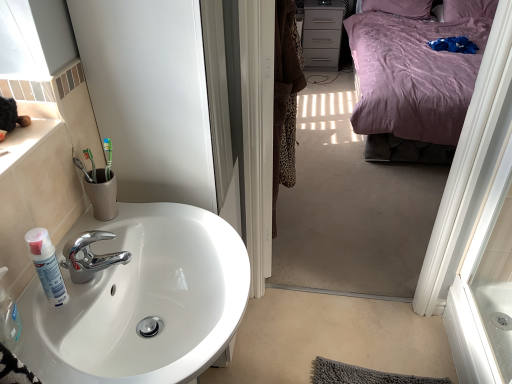
Find the location of a particular element. The image size is (512, 384). purple satin pillow at upper right is located at coordinates (468, 9).

Describe the element at coordinates (468, 9) in the screenshot. The image size is (512, 384). I see `purple satin pillow at upper right` at that location.

Find the location of a particular element. This screenshot has height=384, width=512. white glossy sink at lower left is located at coordinates (142, 301).

The width and height of the screenshot is (512, 384). Describe the element at coordinates (91, 164) in the screenshot. I see `green toothbrush at sink` at that location.

In order to click on green toothbrush at sink in this screenshot , I will do `click(91, 164)`.

This screenshot has width=512, height=384. Find the location of `purple satin pillow at upper right`. purple satin pillow at upper right is located at coordinates (468, 9).

Is purple satin bed at upper right thinner than matte gray cabinet at upper right?

No, purple satin bed at upper right is not thinner than matte gray cabinet at upper right.

Looking at this image, from a real-world perspective, is purple satin bed at upper right beneath matte gray cabinet at upper right?

No, from a real-world perspective, purple satin bed at upper right is not under matte gray cabinet at upper right.

Are purple satin bed at upper right and matte gray cabinet at upper right making contact?

No, purple satin bed at upper right is not in contact with matte gray cabinet at upper right.

Considering the relative sizes of purple satin bed at upper right and matte gray cabinet at upper right in the image provided, is purple satin bed at upper right smaller than matte gray cabinet at upper right?

Actually, purple satin bed at upper right might be larger than matte gray cabinet at upper right.

How distant is green toothbrush at sink from matte gray cabinet at upper right?

green toothbrush at sink is 3.55 meters away from matte gray cabinet at upper right.

From a real-world perspective, which object stands above the other?

green toothbrush at sink is physically above.

In the image, is green toothbrush at sink positioned in front of or behind matte gray cabinet at upper right?

green toothbrush at sink is positioned closer to the viewer than matte gray cabinet at upper right.

Between green toothbrush at sink and matte gray cabinet at upper right, which one has more height?

With more height is matte gray cabinet at upper right.

Find the location of a particular element. Image resolution: width=512 pixels, height=384 pixels. bed above the green toothbrush at sink (from the image's perspective) is located at coordinates pos(412,85).

Which is behind, point (96, 177) or point (389, 18)?

The point (389, 18) is farther.

From the image's perspective, is green toothbrush at sink on purple satin bed at upper right?

No.

Does green toothbrush at sink have a greater height compared to purple satin bed at upper right?

No.

Is point (44, 230) closer or farther from the camera than point (170, 322)?

Point (44, 230) appears to be closer to the viewer than point (170, 322).

Is white matte spray can at sink left with white glossy sink at lower left?

No, white matte spray can at sink left is not in contact with white glossy sink at lower left.

From a real-world perspective, which object rests below the other?

From a 3D spatial view, white glossy sink at lower left is below.

Is white matte spray can at sink left positioned with its back to white glossy sink at lower left?

No.

Is purple satin pillow at upper right not within green toothbrush at sink?

That's correct, purple satin pillow at upper right is outside of green toothbrush at sink.

Does purple satin pillow at upper right have a greater height compared to green toothbrush at sink?

Indeed, purple satin pillow at upper right has a greater height compared to green toothbrush at sink.

Is there a large distance between purple satin pillow at upper right and green toothbrush at sink?

Yes.

From a real-world perspective, is purple satin pillow at upper right positioned over green toothbrush at sink based on gravity?

No.

Does green toothbrush at sink have a smaller size compared to white glossy sink at lower left?

Indeed, green toothbrush at sink has a smaller size compared to white glossy sink at lower left.

Is green toothbrush at sink far away from white glossy sink at lower left?

Actually, green toothbrush at sink and white glossy sink at lower left are a little close together.

You are a GUI agent. You are given a task and a screenshot of the screen. Output one action in this format:
    pyautogui.click(x=<x>, y=<y>)
    Task: Click on the sink that is under the green toothbrush at sink (from a real-world perspective)
    
    Given the screenshot: What is the action you would take?
    pyautogui.click(x=142, y=301)

Is point (95, 181) positioned after point (185, 254)?

No, (95, 181) is in front of (185, 254).

Is white matte spray can at sink left completely or partially inside purple satin bed at upper right?

No.

Between purple satin bed at upper right and white matte spray can at sink left, which one has smaller size?

white matte spray can at sink left is smaller.

Between purple satin bed at upper right and white matte spray can at sink left, which one has less height?

white matte spray can at sink left is shorter.

Locate an element on the screen. The image size is (512, 384). bed located on the right of matte gray cabinet at upper right is located at coordinates (412, 85).

The width and height of the screenshot is (512, 384). I want to click on toothbrush that appears below the matte gray cabinet at upper right (from the image's perspective), so (x=91, y=164).

Which object lies nearer to the anchor point white glossy sink at lower left, green toothbrush at sink or matte gray cabinet at upper right?

Among the two, green toothbrush at sink is located nearer to white glossy sink at lower left.

Which object lies further to the anchor point white matte spray can at sink left, purple satin pillow at upper right or green toothbrush at sink?

purple satin pillow at upper right is positioned further to the anchor white matte spray can at sink left.

Which object lies nearer to the anchor point purple satin pillow at upper right, white matte spray can at sink left or white glossy sink at lower left?

white glossy sink at lower left is positioned closer to the anchor purple satin pillow at upper right.

In the scene shown: Which object lies further to the anchor point purple satin bed at upper right, green toothbrush at sink or matte gray cabinet at upper right?

green toothbrush at sink is further to purple satin bed at upper right.

When comparing their distances from purple satin pillow at upper right, does white glossy sink at lower left or white matte spray can at sink left seem closer?

Based on the image, white glossy sink at lower left appears to be nearer to purple satin pillow at upper right.

Considering their positions, is purple satin bed at upper right positioned closer to white matte spray can at sink left than white glossy sink at lower left?

The object closer to white matte spray can at sink left is white glossy sink at lower left.

Looking at the image, which one is located closer to green toothbrush at sink, matte gray cabinet at upper right or white glossy sink at lower left?

white glossy sink at lower left.

Considering their positions, is purple satin bed at upper right positioned closer to green toothbrush at sink than white matte spray can at sink left?

white matte spray can at sink left lies closer to green toothbrush at sink than the other object.

This screenshot has height=384, width=512. Identify the location of bottle between white glossy sink at lower left and purple satin pillow at upper right along the z-axis. (47, 265).

Identify the location of bed positioned between white glossy sink at lower left and matte gray cabinet at upper right from near to far. Image resolution: width=512 pixels, height=384 pixels. (412, 85).

I want to click on toothbrush between white matte spray can at sink left and purple satin pillow at upper right along the z-axis, so click(x=91, y=164).

You are a GUI agent. You are given a task and a screenshot of the screen. Output one action in this format:
    pyautogui.click(x=<x>, y=<y>)
    Task: Click on the toothbrush between white matte spray can at sink left and purple satin bed at upper right
    This screenshot has width=512, height=384.
    Given the screenshot: What is the action you would take?
    pyautogui.click(x=91, y=164)